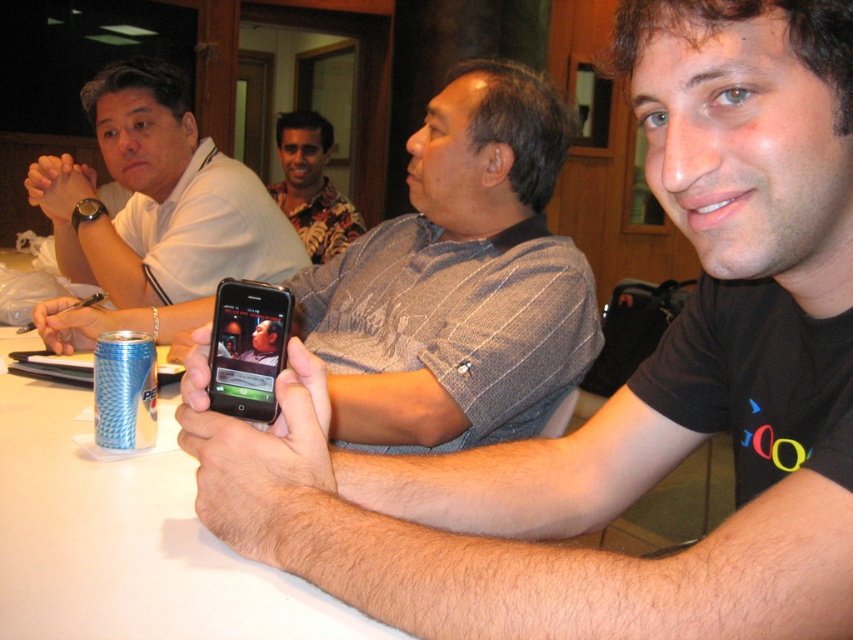
Looking at this image, you are a photographer standing at the entrance of the room. You want to take a photo of the floral shirt at center. Where should you position yourself to capture the best angle?

The floral shirt at center is located at point 0.291 on the x axis and 0.366 on the y axis, so positioning yourself directly in front of that coordinate would provide the best angle for capturing the floral shirt at center.

Based on the photo, you are a photographer taking a picture of the white matte shirt at upper left and the floral shirt at center. Which one will appear smaller in the photo?

The white matte shirt at upper left is shorter than the floral shirt at center, so it will appear smaller in the photo.

Consider the image. You are a photographer trying to capture a photo of the floral shirt at center and the blue textured can at lower left. Which object should you zoom in on to ensure both are clearly visible in the frame?

The floral shirt at center is larger in size compared to the blue textured can at lower left, so you should zoom in on the floral shirt at center to ensure both objects are clearly visible.